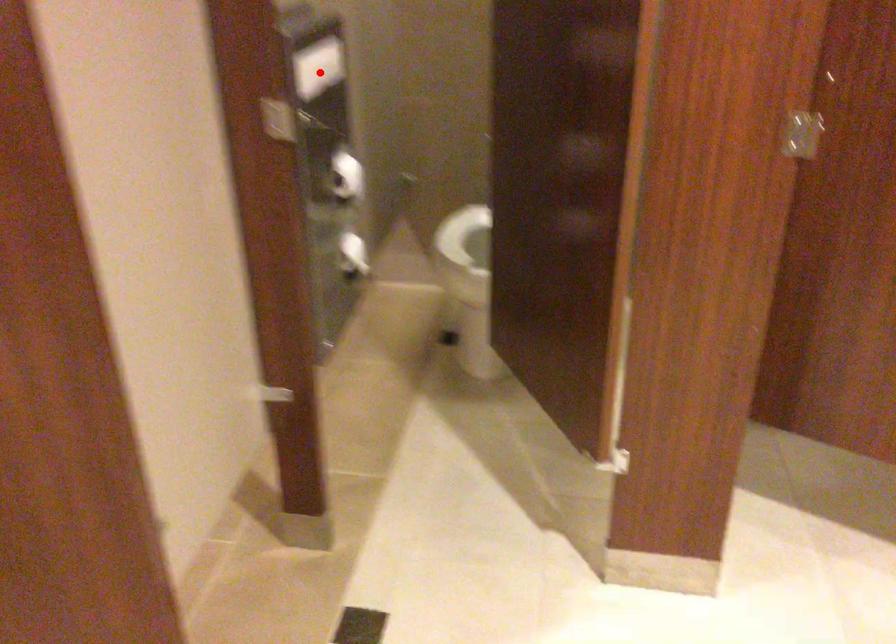
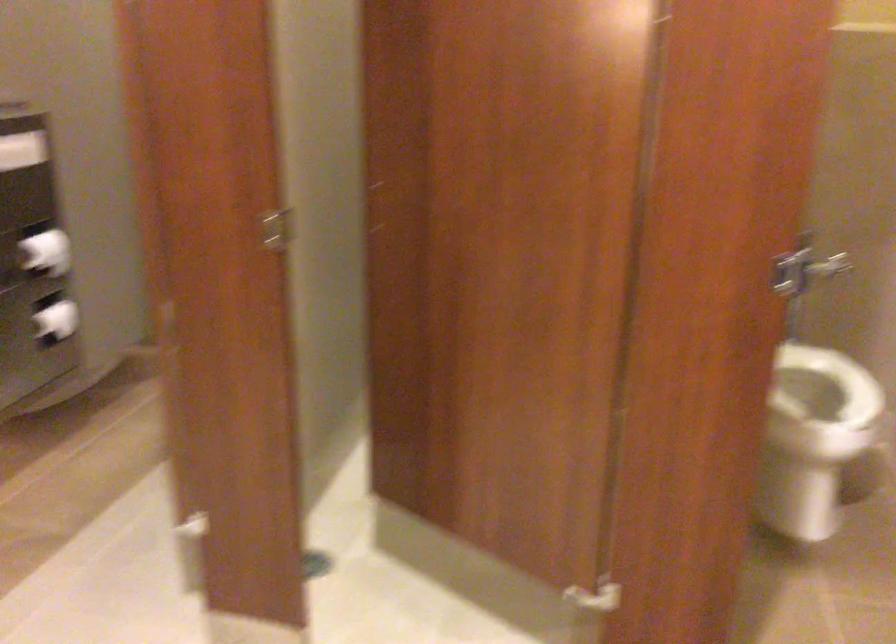
The point at the highlighted location is marked in the first image. Where is the corresponding point in the second image?

(22, 149)